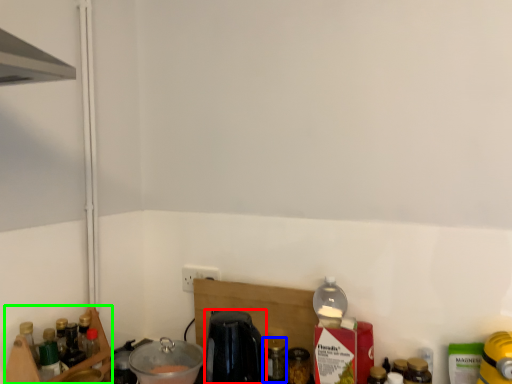
Question: Which is farther away from coffee machine (highlighted by a red box)? bottle (highlighted by a blue box) or shelf (highlighted by a green box)?

Choices:
 (A) bottle
 (B) shelf

Answer: (B)